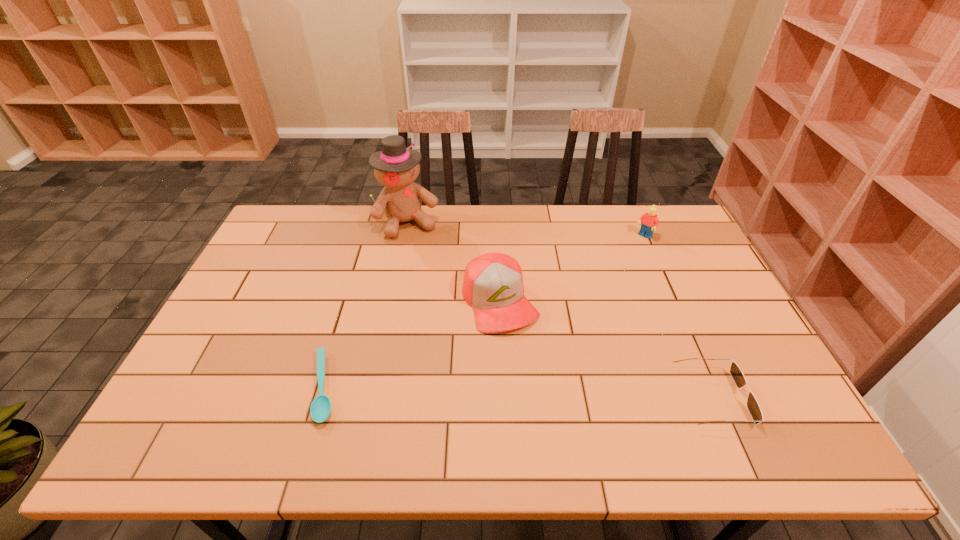
Locate an element on the screen. vacant point located between the tallest object and the shortest object is located at coordinates (366, 305).

Locate an element on the screen. The height and width of the screenshot is (540, 960). vacant area that lies between the baseball cap and the shortest object is located at coordinates (412, 344).

At what (x,y) coordinates should I click in order to perform the action: click on vacant point located between the spoon and the fourth tallest object. Please return your answer as a coordinate pair (x, y). Looking at the image, I should click on (517, 393).

Locate an element on the screen. The width and height of the screenshot is (960, 540). free space between the third farthest object and the tallest object is located at coordinates (454, 261).

Where is `empty location between the third object from right to left and the Lego`? The height and width of the screenshot is (540, 960). empty location between the third object from right to left and the Lego is located at coordinates (571, 269).

The width and height of the screenshot is (960, 540). Find the location of `free space between the spoon and the third farthest object`. free space between the spoon and the third farthest object is located at coordinates (412, 344).

The width and height of the screenshot is (960, 540). I want to click on vacant space in between the shortest object and the third object from left to right, so click(412, 344).

The image size is (960, 540). Find the location of `free space that is in between the rag_doll and the Lego`. free space that is in between the rag_doll and the Lego is located at coordinates point(526,230).

Locate an element on the screen. The image size is (960, 540). vacant space in between the third object from left to right and the second shortest object is located at coordinates (606, 349).

Choose which object is the third nearest neighbor to the fourth tallest object. Please provide its 2D coordinates. Your answer should be formatted as a tuple, i.e. [(x, y)], where the tuple contains the x and y coordinates of a point satisfying the conditions above.

[(396, 167)]